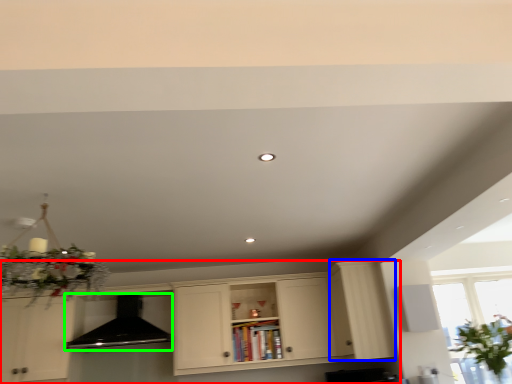
Question: Which object is the closest to the cabinetry (highlighted by a red box)? Choose among these: cabinetry (highlighted by a blue box) or exhaust hood (highlighted by a green box).

Choices:
 (A) cabinetry
 (B) exhaust hood

Answer: (A)